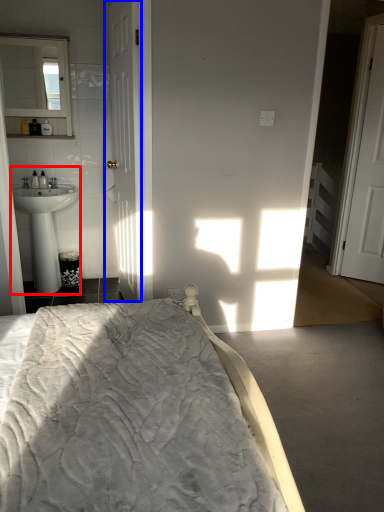
Question: Which object appears closest to the camera in this image, sink (highlighted by a red box) or door (highlighted by a blue box)?

Choices:
 (A) sink
 (B) door

Answer: (B)